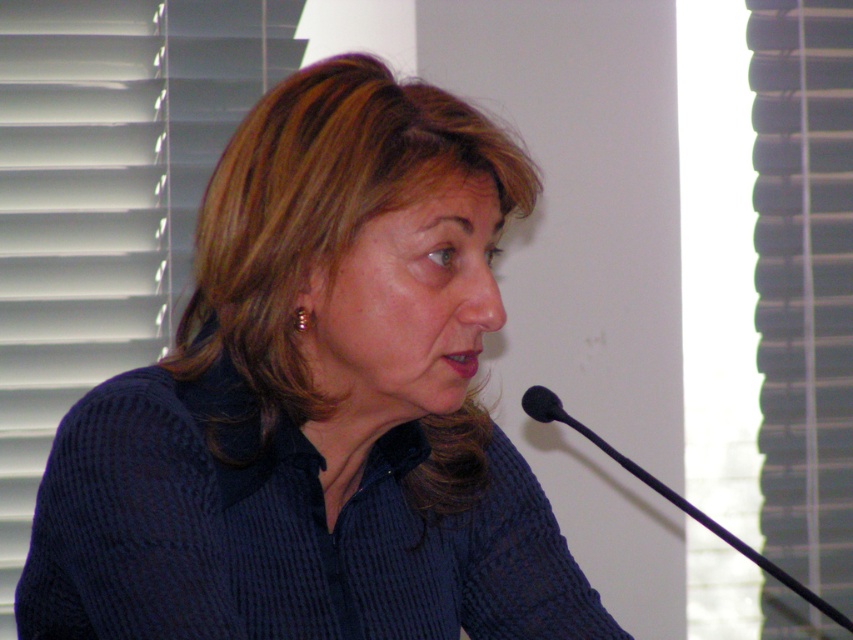
You are an event organizer setting up for a presentation. You need to ensure the dark blue textured shirt at center is visible to the audience. Given its position relative to the black plastic microphone at lower right, where should you place the spotlight to best highlight the speaker?

The dark blue textured shirt at center is positioned under the black plastic microphone at lower right. To best highlight the speaker, place the spotlight above the microphone so that the light shines downward onto the shirt, avoiding shadows cast by the microphone itself.

You are organizing a presentation and need to ensure all items fit on a 1.2 meter wide table. The dark blue textured shirt at center and the black plastic microphone at lower right are both placed on the table. Given their widths, can both items fit side by side on the table without overlapping?

The dark blue textured shirt at center is wider than the black plastic microphone at lower right. However, without knowing their exact widths, it is impossible to determine if they can fit side by side on a 1.2 meter wide table. Additional measurements are needed.